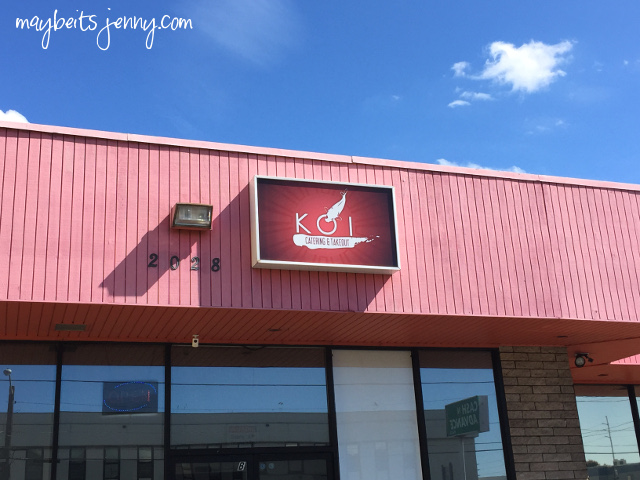
Where is `light`? The height and width of the screenshot is (480, 640). light is located at coordinates (191, 213).